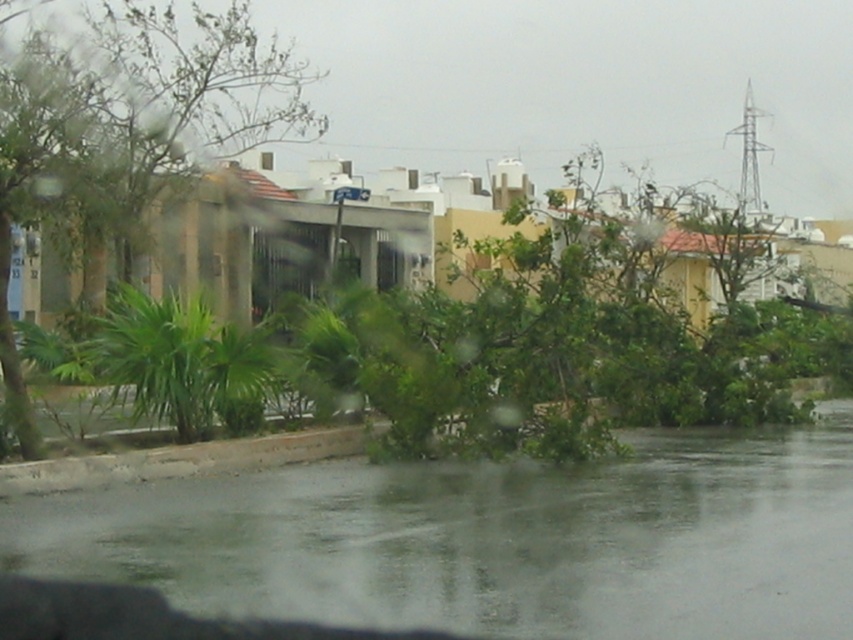
Does point (735, 468) come farther from viewer compared to point (144, 128)?

No, it is not.

Is point (254, 556) closer to viewer compared to point (164, 51)?

Yes, it is.

Describe the element at coordinates (492, 540) in the screenshot. I see `clear water at lower center` at that location.

The height and width of the screenshot is (640, 853). Identify the location of clear water at lower center. (492, 540).